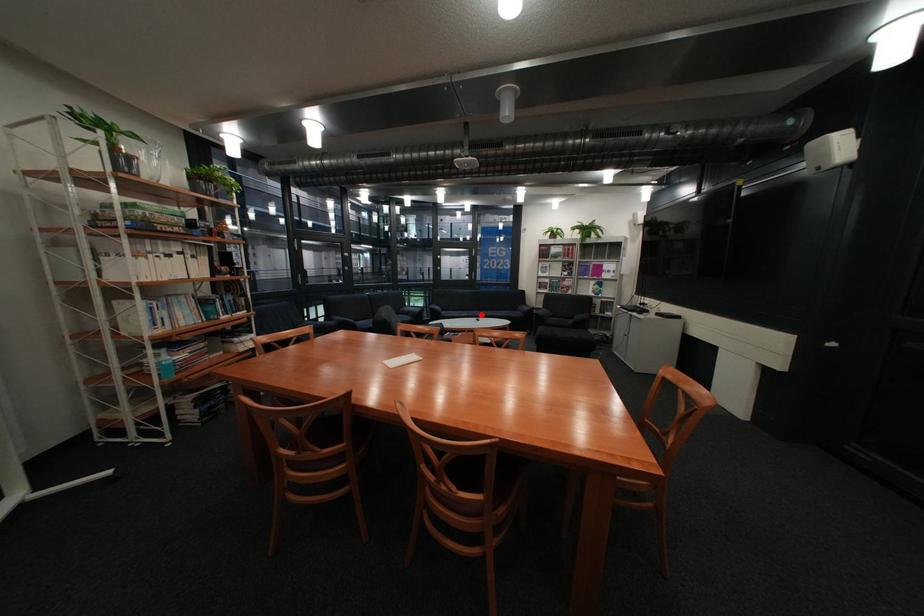
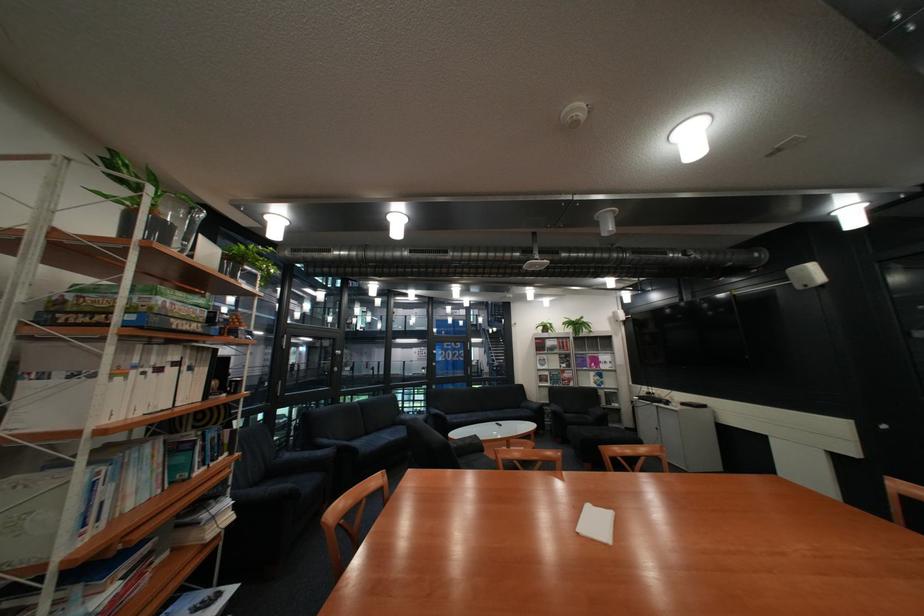
Question: I am providing you with two images of the same scene from different viewpoints. Image1 has a red point marked. In image2, the corresponding 3D location appears at what relative position? Reply with the corresponding letter.

Choices:
 (A) Closer
 (B) Farther

Answer: (A)